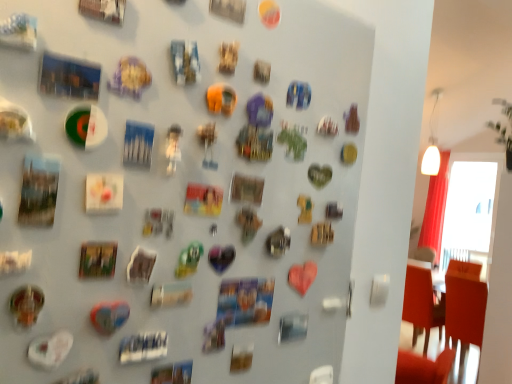
Question: Considering the relative positions of metallic fridge magnets at center and orange fabric chair at right in the image provided, is metallic fridge magnets at center to the left or to the right of orange fabric chair at right?

Choices:
 (A) right
 (B) left

Answer: (B)

Question: From a real-world perspective, is metallic fridge magnets at center positioned above or below orange fabric chair at right?

Choices:
 (A) above
 (B) below

Answer: (A)

Question: Which is nearer to the wooden framed picture at center-left, which is counted as the fourth art, starting from the bottom?

Choices:
 (A) metallic silver magnet at center-left, the 3th art positioned from the bottom
 (B) white glass window screen at upper right
 (C) metallic gold coin at lower left, which appears as the second art when ordered from the bottom
 (D) blue paper at center, the sixth art from the bottom
 (E) gold textured coin at upper center, which ranks as the 5th art in bottom-to-top order

Answer: (A)

Question: Estimate the real-world distances between objects in this image. Which object is farther from the gold textured coin at upper center, which ranks as the 5th art in bottom-to-top order?

Choices:
 (A) metallic gold coin at lower left, the 5th art in the top-to-bottom sequence
 (B) orange fabric chair at right
 (C) shiny metallic heart at center, which appears as the first art when ordered from the bottom
 (D) wooden framed picture at center-left, which is counted as the fourth art, starting from the bottom
 (E) white glass window screen at upper right

Answer: (E)